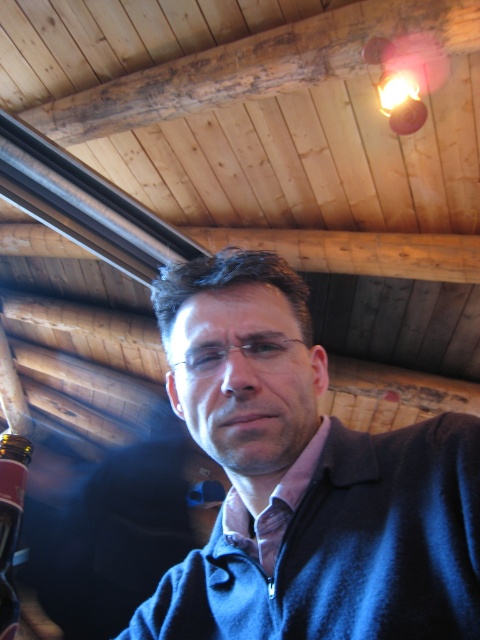
Does point (370, 588) come behind point (20, 460)?

No, (370, 588) is in front of (20, 460).

Is blue fleece jacket at center shorter than translucent glass bottle at lower left?

No, blue fleece jacket at center is not shorter than translucent glass bottle at lower left.

Does point (175, 307) lie behind point (17, 465)?

No, (175, 307) is closer to viewer.

The width and height of the screenshot is (480, 640). What are the coordinates of `blue fleece jacket at center` in the screenshot? It's located at 304,481.